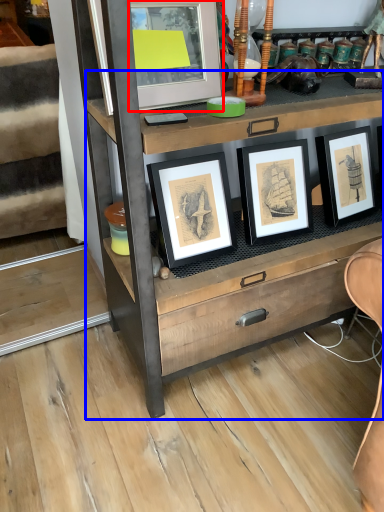
Question: Which object is further to the camera taking this photo, picture frame (highlighted by a red box) or chest of drawers (highlighted by a blue box)?

Choices:
 (A) picture frame
 (B) chest of drawers

Answer: (A)